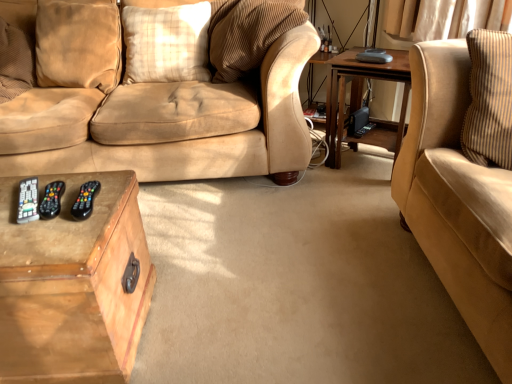
You are a GUI agent. You are given a task and a screenshot of the screen. Output one action in this format:
    pyautogui.click(x=<x>, y=<y>)
    Task: Click on the free space to the right of wooden trunk at lower left, the 1th table from the left
    
    Given the screenshot: What is the action you would take?
    pyautogui.click(x=214, y=302)